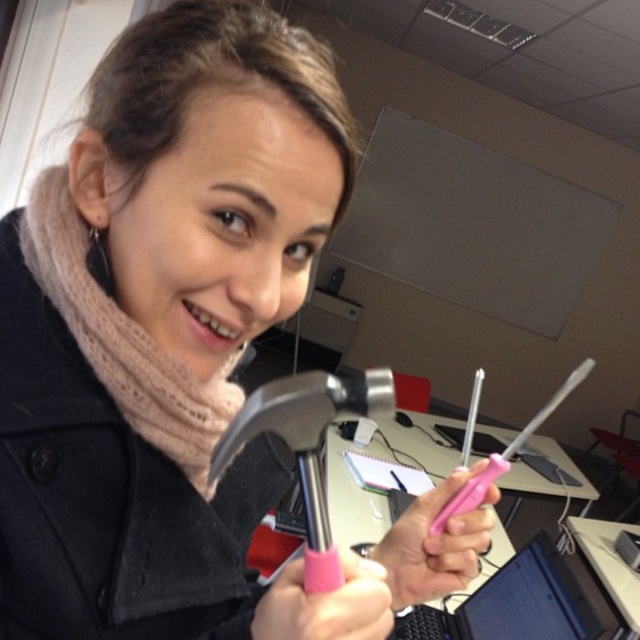
Question: Does pink plastic screwdriver at center have a greater width compared to pink plastic screwdriver at lower center?

Choices:
 (A) yes
 (B) no

Answer: (A)

Question: From the image, what is the correct spatial relationship of brushed metal hammer at center in relation to pink plastic screwdriver at lower center?

Choices:
 (A) above
 (B) below

Answer: (A)

Question: Estimate the real-world distances between objects in this image. Which object is farther from the brushed metal hammer at center?

Choices:
 (A) pink plastic screwdriver at lower center
 (B) pink plastic screwdriver at center

Answer: (B)

Question: Which point is closer to the camera?

Choices:
 (A) brushed metal hammer at center
 (B) pink plastic screwdriver at lower center
 (C) knitted beige scarf at upper left
 (D) pink plastic screwdriver at center

Answer: (B)

Question: Which point is farther from the camera taking this photo?

Choices:
 (A) (486, 531)
 (B) (376, 401)

Answer: (A)

Question: Can you confirm if brushed metal hammer at center is positioned above pink plastic screwdriver at lower center?

Choices:
 (A) no
 (B) yes

Answer: (B)